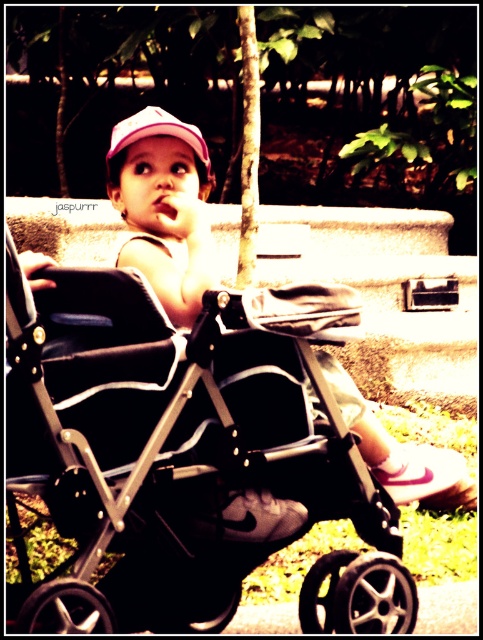
Question: Can you confirm if pink fabric toddler at center is smaller than pink fabric cap at upper center?

Choices:
 (A) no
 (B) yes

Answer: (A)

Question: Which of these objects is positioned farthest from the black matte baby carriage at center?

Choices:
 (A) pink fabric toddler at center
 (B) pink fabric cap at upper center

Answer: (B)

Question: Is black matte baby carriage at center bigger than pink fabric cap at upper center?

Choices:
 (A) yes
 (B) no

Answer: (A)

Question: Which point is closer to the camera?

Choices:
 (A) pink fabric cap at upper center
 (B) pink fabric toddler at center

Answer: (B)

Question: Estimate the real-world distances between objects in this image. Which object is closer to the black matte baby carriage at center?

Choices:
 (A) pink fabric toddler at center
 (B) pink fabric cap at upper center

Answer: (A)

Question: Can you confirm if pink fabric toddler at center is bigger than pink fabric cap at upper center?

Choices:
 (A) no
 (B) yes

Answer: (B)